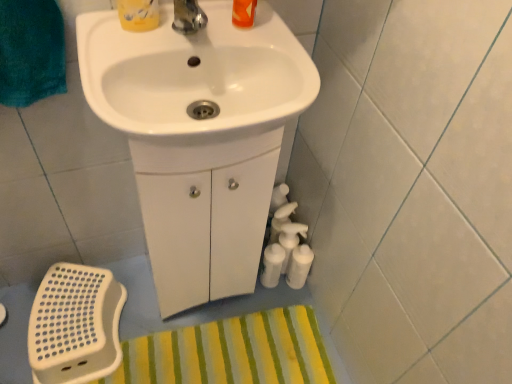
Image resolution: width=512 pixels, height=384 pixels. What do you see at coordinates (231, 352) in the screenshot? I see `yellow striped bath mat at lower center` at bounding box center [231, 352].

From the picture: Measure the distance between white glossy sink at upper center, marked as the 2th sink in a back-to-front arrangement, and camera.

The depth of white glossy sink at upper center, marked as the 2th sink in a back-to-front arrangement, is 24.58 inches.

In order to face matte yellow container at upper center, should I rotate leftwards or rightwards?

Turn left by 15.522 degrees to look at matte yellow container at upper center.

At what (x,y) coordinates should I click in order to perform the action: click on matte yellow container at upper center. Please return your answer as a coordinate pair (x, y). The height and width of the screenshot is (384, 512). Looking at the image, I should click on (138, 14).

Locate an element on the screen. This screenshot has width=512, height=384. white glossy sink at center, the second sink when ordered from front to back is located at coordinates point(199,137).

Considering the sizes of objects yellow striped bath mat at lower center and white glossy sink at upper center, which ranks as the 1th sink in front-to-back order, in the image provided, who is wider, yellow striped bath mat at lower center or white glossy sink at upper center, which ranks as the 1th sink in front-to-back order,?

yellow striped bath mat at lower center.

Which object is positioned more to the left, yellow striped bath mat at lower center or white glossy sink at upper center, which ranks as the 1th sink in front-to-back order?

From the viewer's perspective, yellow striped bath mat at lower center appears more on the left side.

Can you confirm if yellow striped bath mat at lower center is smaller than white glossy sink at upper center, marked as the 2th sink in a back-to-front arrangement?

Yes, yellow striped bath mat at lower center is smaller than white glossy sink at upper center, marked as the 2th sink in a back-to-front arrangement.

From a real-world perspective, who is located higher, yellow striped bath mat at lower center or white glossy sink at upper center, which ranks as the 1th sink in front-to-back order?

white glossy sink at upper center, which ranks as the 1th sink in front-to-back order.

Is white glossy sink at upper center, marked as the 2th sink in a back-to-front arrangement, oriented towards yellow striped bath mat at lower center?

No.

How many degrees apart are the facing directions of white glossy sink at upper center, marked as the 2th sink in a back-to-front arrangement, and yellow striped bath mat at lower center?

There is a 90.9-degree angle between the facing directions of white glossy sink at upper center, marked as the 2th sink in a back-to-front arrangement, and yellow striped bath mat at lower center.

Between white glossy sink at upper center, marked as the 2th sink in a back-to-front arrangement, and yellow striped bath mat at lower center, which one has less height?

With less height is yellow striped bath mat at lower center.

Considering their positions, is white glossy sink at upper center, which ranks as the 1th sink in front-to-back order, located in front of or behind matte yellow container at upper center?

In the image, white glossy sink at upper center, which ranks as the 1th sink in front-to-back order, appears in front of matte yellow container at upper center.

Which object is positioned more to the left, white glossy sink at upper center, which ranks as the 1th sink in front-to-back order, or matte yellow container at upper center?

Positioned to the left is matte yellow container at upper center.

Locate an element on the screen. The height and width of the screenshot is (384, 512). toiletry above the white glossy sink at upper center, marked as the 2th sink in a back-to-front arrangement (from a real-world perspective) is located at coordinates (138, 14).

From the picture: How many degrees apart are the facing directions of white glossy sink at upper center, marked as the 2th sink in a back-to-front arrangement, and matte yellow container at upper center?

They differ by 0.00137 degrees in their facing directions.

From a real-world perspective, which is physically below, white glossy sink at upper center, marked as the 2th sink in a back-to-front arrangement, or white glossy sink at center, the second sink when ordered from front to back?

white glossy sink at center, the second sink when ordered from front to back, from a real-world perspective.

Is white glossy sink at upper center, which ranks as the 1th sink in front-to-back order, far from white glossy sink at center, the second sink when ordered from front to back?

That's not correct — white glossy sink at upper center, which ranks as the 1th sink in front-to-back order, is a little close to white glossy sink at center, the second sink when ordered from front to back.

Is white glossy sink at upper center, which ranks as the 1th sink in front-to-back order, facing towards white glossy sink at center, the first sink from the back?

No, white glossy sink at upper center, which ranks as the 1th sink in front-to-back order, is not facing towards white glossy sink at center, the first sink from the back.

From the image's perspective, is white glossy sink at upper center, marked as the 2th sink in a back-to-front arrangement, beneath white glossy sink at center, the first sink from the back?

No, from the image's perspective, white glossy sink at upper center, marked as the 2th sink in a back-to-front arrangement, is not below white glossy sink at center, the first sink from the back.

Which is more distant, [256,357] or [149,126]?

The point [256,357] is farther.

Considering the sizes of yellow striped bath mat at lower center and white glossy sink at center, the second sink when ordered from front to back, in the image, is yellow striped bath mat at lower center wider or thinner than white glossy sink at center, the second sink when ordered from front to back,?

In the image, yellow striped bath mat at lower center appears to be wider than white glossy sink at center, the second sink when ordered from front to back.

Looking at this image, can we say yellow striped bath mat at lower center lies outside white glossy sink at center, the first sink from the back?

Yes, yellow striped bath mat at lower center is located beyond the bounds of white glossy sink at center, the first sink from the back.

Would you say yellow striped bath mat at lower center is a long distance from white glossy sink at center, the first sink from the back?

yellow striped bath mat at lower center is actually quite close to white glossy sink at center, the first sink from the back.

Is point (321, 373) positioned before point (127, 18)?

No, it is behind (127, 18).

Find the location of `bath mat that is below the matte yellow container at upper center (from the image's perspective)`. bath mat that is below the matte yellow container at upper center (from the image's perspective) is located at coordinates (231, 352).

Does yellow striped bath mat at lower center have a larger size compared to matte yellow container at upper center?

Correct, yellow striped bath mat at lower center is larger in size than matte yellow container at upper center.

From a real-world perspective, is yellow striped bath mat at lower center physically located above or below matte yellow container at upper center?

From a real-world perspective, yellow striped bath mat at lower center is physically below matte yellow container at upper center.

Between point (238, 219) and point (272, 333), which one is positioned behind?

Positioned behind is point (272, 333).

Is white glossy sink at center, the first sink from the back, not close to yellow striped bath mat at lower center?

Actually, white glossy sink at center, the first sink from the back, and yellow striped bath mat at lower center are a little close together.

Considering the relative positions of white glossy sink at center, the first sink from the back, and yellow striped bath mat at lower center in the image provided, is white glossy sink at center, the first sink from the back, to the right of yellow striped bath mat at lower center from the viewer's perspective?

Correct, you'll find white glossy sink at center, the first sink from the back, to the right of yellow striped bath mat at lower center.

Could you measure the distance between white glossy sink at center, the second sink when ordered from front to back, and yellow striped bath mat at lower center?

white glossy sink at center, the second sink when ordered from front to back, and yellow striped bath mat at lower center are 17.75 inches apart from each other.

Where is `the 2nd sink to the right of the yellow striped bath mat at lower center, counting from the anchor's position`? This screenshot has height=384, width=512. the 2nd sink to the right of the yellow striped bath mat at lower center, counting from the anchor's position is located at coordinates (193, 72).

From the yellow striped bath mat at lower center, count 2nd sinks forward and point to it. Please provide its 2D coordinates.

[(193, 72)]

Estimate the real-world distances between objects in this image. Which object is closer to yellow striped bath mat at lower center, white glossy sink at upper center, marked as the 2th sink in a back-to-front arrangement, or white glossy sink at center, the second sink when ordered from front to back?

white glossy sink at center, the second sink when ordered from front to back, lies closer to yellow striped bath mat at lower center than the other object.

Looking at the image, which one is located closer to white glossy sink at center, the first sink from the back, white glossy sink at upper center, which ranks as the 1th sink in front-to-back order, or yellow striped bath mat at lower center?

white glossy sink at upper center, which ranks as the 1th sink in front-to-back order, lies closer to white glossy sink at center, the first sink from the back, than the other object.

Based on the photo, considering their positions, is matte yellow container at upper center positioned further to white glossy sink at upper center, marked as the 2th sink in a back-to-front arrangement, than yellow striped bath mat at lower center?

The object further to white glossy sink at upper center, marked as the 2th sink in a back-to-front arrangement, is yellow striped bath mat at lower center.

From the image, which object appears to be nearer to yellow striped bath mat at lower center, white glossy sink at upper center, marked as the 2th sink in a back-to-front arrangement, or matte yellow container at upper center?

The object closer to yellow striped bath mat at lower center is white glossy sink at upper center, marked as the 2th sink in a back-to-front arrangement.

Looking at the image, which one is located further to white glossy sink at center, the second sink when ordered from front to back, matte yellow container at upper center or white glossy sink at upper center, marked as the 2th sink in a back-to-front arrangement?

matte yellow container at upper center is further to white glossy sink at center, the second sink when ordered from front to back.

Estimate the real-world distances between objects in this image. Which object is further from matte yellow container at upper center, white glossy sink at center, the second sink when ordered from front to back, or white glossy sink at upper center, which ranks as the 1th sink in front-to-back order?

Among the two, white glossy sink at center, the second sink when ordered from front to back, is located further to matte yellow container at upper center.

Looking at the image, which one is located further to white glossy sink at upper center, marked as the 2th sink in a back-to-front arrangement, white glossy sink at center, the first sink from the back, or yellow striped bath mat at lower center?

Among the two, yellow striped bath mat at lower center is located further to white glossy sink at upper center, marked as the 2th sink in a back-to-front arrangement.

Based on their spatial positions, is white glossy sink at center, the first sink from the back, or matte yellow container at upper center closer to white glossy sink at upper center, which ranks as the 1th sink in front-to-back order?

Based on the image, white glossy sink at center, the first sink from the back, appears to be nearer to white glossy sink at upper center, which ranks as the 1th sink in front-to-back order.

At what (x,y) coordinates should I click in order to perform the action: click on sink that lies between white glossy sink at upper center, marked as the 2th sink in a back-to-front arrangement, and yellow striped bath mat at lower center from top to bottom. Please return your answer as a coordinate pair (x, y). The image size is (512, 384). Looking at the image, I should click on (199, 137).

I want to click on sink between matte yellow container at upper center and white glossy sink at center, the second sink when ordered from front to back, in the up-down direction, so click(193, 72).